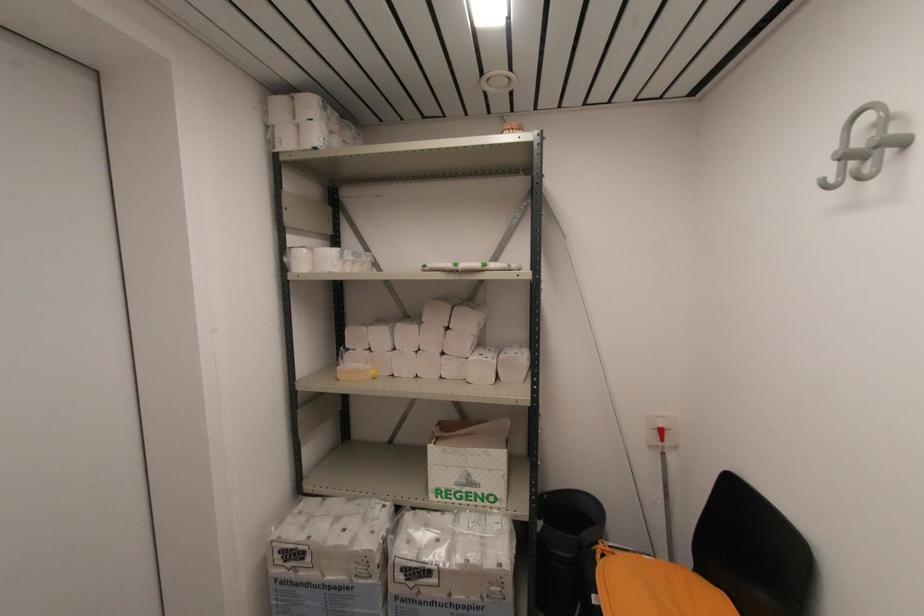
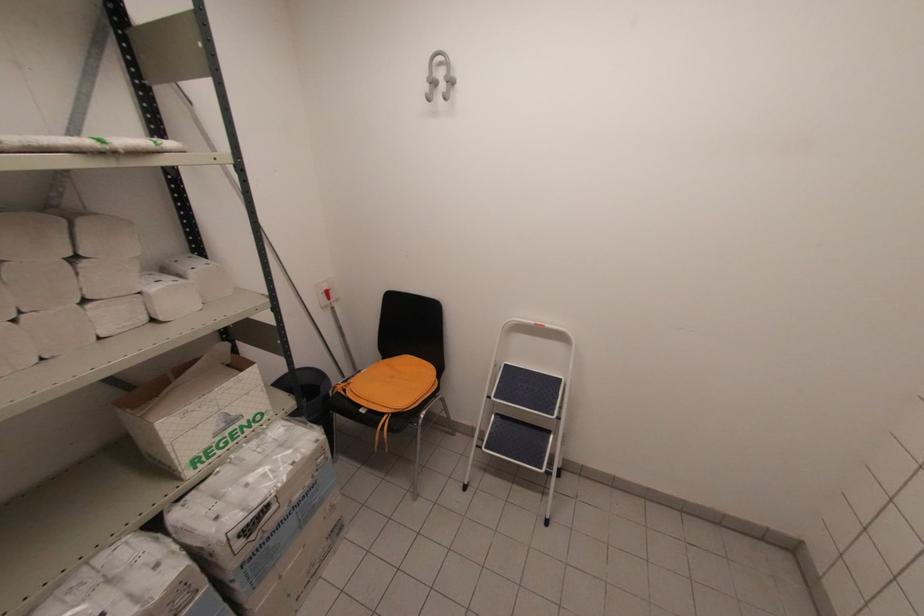
In the second image, find the point that corresponds to the point at 663,439 in the first image.

(330, 299)